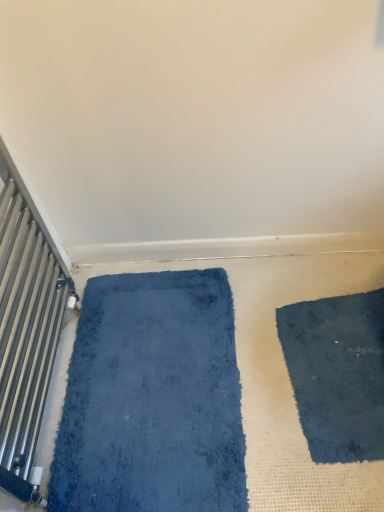
Find the location of a particular element. The height and width of the screenshot is (512, 384). metallic silver radiator at left is located at coordinates (25, 335).

What do you see at coordinates (337, 374) in the screenshot? The width and height of the screenshot is (384, 512). I see `dark blue shaggy mat at lower right` at bounding box center [337, 374].

Locate an element on the screen. The image size is (384, 512). blue plush bath mat at left is located at coordinates pos(152,399).

Locate an element on the screen. This screenshot has height=512, width=384. metallic silver radiator at left is located at coordinates (25, 335).

From the picture: Is blue plush bath mat at left bigger than metallic silver radiator at left?

Incorrect, blue plush bath mat at left is not larger than metallic silver radiator at left.

Is blue plush bath mat at left oriented towards metallic silver radiator at left?

No, blue plush bath mat at left is not facing towards metallic silver radiator at left.

Is point (136, 503) closer to viewer compared to point (41, 369)?

Yes, it is.

Looking at this image, who is more distant, blue plush bath mat at left or metallic silver radiator at left?

blue plush bath mat at left.

Does metallic silver radiator at left have a lesser width compared to dark blue shaggy mat at lower right?

Yes.

From a real-world perspective, is metallic silver radiator at left physically below dark blue shaggy mat at lower right?

Actually, metallic silver radiator at left is physically above dark blue shaggy mat at lower right in the real world.

Considering the relative sizes of metallic silver radiator at left and dark blue shaggy mat at lower right in the image provided, is metallic silver radiator at left shorter than dark blue shaggy mat at lower right?

In fact, metallic silver radiator at left may be taller than dark blue shaggy mat at lower right.

Considering the relative positions of metallic silver radiator at left and dark blue shaggy mat at lower right in the image provided, is metallic silver radiator at left to the left of dark blue shaggy mat at lower right from the viewer's perspective?

Yes, metallic silver radiator at left is to the left of dark blue shaggy mat at lower right.

Is point (365, 308) closer to camera compared to point (38, 386)?

No, it is behind (38, 386).

Does dark blue shaggy mat at lower right touch metallic silver radiator at left?

No, dark blue shaggy mat at lower right is not with metallic silver radiator at left.

From a real-world perspective, between dark blue shaggy mat at lower right and metallic silver radiator at left, who is vertically higher?

metallic silver radiator at left.

Considering the sizes of objects dark blue shaggy mat at lower right and metallic silver radiator at left in the image provided, who is thinner, dark blue shaggy mat at lower right or metallic silver radiator at left?

Thinner between the two is metallic silver radiator at left.

Is blue plush bath mat at left closer to camera compared to dark blue shaggy mat at lower right?

That is True.

Visually, is blue plush bath mat at left positioned to the left or to the right of dark blue shaggy mat at lower right?

In the image, blue plush bath mat at left appears on the left side of dark blue shaggy mat at lower right.

Is dark blue shaggy mat at lower right at the back of blue plush bath mat at left?

Yes, blue plush bath mat at left is facing away from dark blue shaggy mat at lower right.

Considering the points (226, 298) and (330, 341), which point is behind, point (226, 298) or point (330, 341)?

The point (226, 298) is more distant.

How many degrees apart are the facing directions of metallic silver radiator at left and blue plush bath mat at left?

They differ by 180 degrees in their facing directions.

Is metallic silver radiator at left bigger or smaller than blue plush bath mat at left?

metallic silver radiator at left is bigger than blue plush bath mat at left.

From a real-world perspective, is metallic silver radiator at left under blue plush bath mat at left?

Incorrect, from a real-world perspective, metallic silver radiator at left is higher than blue plush bath mat at left.

From the image's perspective, is metallic silver radiator at left located beneath blue plush bath mat at left?

Actually, metallic silver radiator at left appears above blue plush bath mat at left in the image.

Would you say dark blue shaggy mat at lower right is outside blue plush bath mat at left?

Yes, dark blue shaggy mat at lower right is not within blue plush bath mat at left.

Does dark blue shaggy mat at lower right have a larger size compared to blue plush bath mat at left?

Actually, dark blue shaggy mat at lower right might be smaller than blue plush bath mat at left.

From a real-world perspective, which is physically below, dark blue shaggy mat at lower right or blue plush bath mat at left?

dark blue shaggy mat at lower right is physically lower.

Would you say dark blue shaggy mat at lower right is a long distance from blue plush bath mat at left?

No, there isn't a large distance between dark blue shaggy mat at lower right and blue plush bath mat at left.

I want to click on bath mat on the right side of metallic silver radiator at left, so click(x=152, y=399).

In the image, there is a dark blue shaggy mat at lower right. At what (x,y) coordinates should I click in order to perform the action: click on radiator above it (from the image's perspective). Please return your answer as a coordinate pair (x, y). Image resolution: width=384 pixels, height=512 pixels. Looking at the image, I should click on (25, 335).

From the picture: Considering their positions, is dark blue shaggy mat at lower right positioned closer to metallic silver radiator at left than blue plush bath mat at left?

blue plush bath mat at left.

When comparing their distances from blue plush bath mat at left, does metallic silver radiator at left or dark blue shaggy mat at lower right seem further?

Based on the image, dark blue shaggy mat at lower right appears to be further to blue plush bath mat at left.

Looking at the image, which one is located further to dark blue shaggy mat at lower right, blue plush bath mat at left or metallic silver radiator at left?

Based on the image, metallic silver radiator at left appears to be further to dark blue shaggy mat at lower right.

When comparing their distances from metallic silver radiator at left, does blue plush bath mat at left or dark blue shaggy mat at lower right seem closer?

Among the two, blue plush bath mat at left is located nearer to metallic silver radiator at left.

Based on the photo, looking at the image, which one is located closer to dark blue shaggy mat at lower right, metallic silver radiator at left or blue plush bath mat at left?

Based on the image, blue plush bath mat at left appears to be nearer to dark blue shaggy mat at lower right.

When comparing their distances from blue plush bath mat at left, does dark blue shaggy mat at lower right or metallic silver radiator at left seem further?

dark blue shaggy mat at lower right is further to blue plush bath mat at left.

This screenshot has height=512, width=384. Find the location of `bath mat between metallic silver radiator at left and dark blue shaggy mat at lower right from left to right`. bath mat between metallic silver radiator at left and dark blue shaggy mat at lower right from left to right is located at coordinates (152, 399).